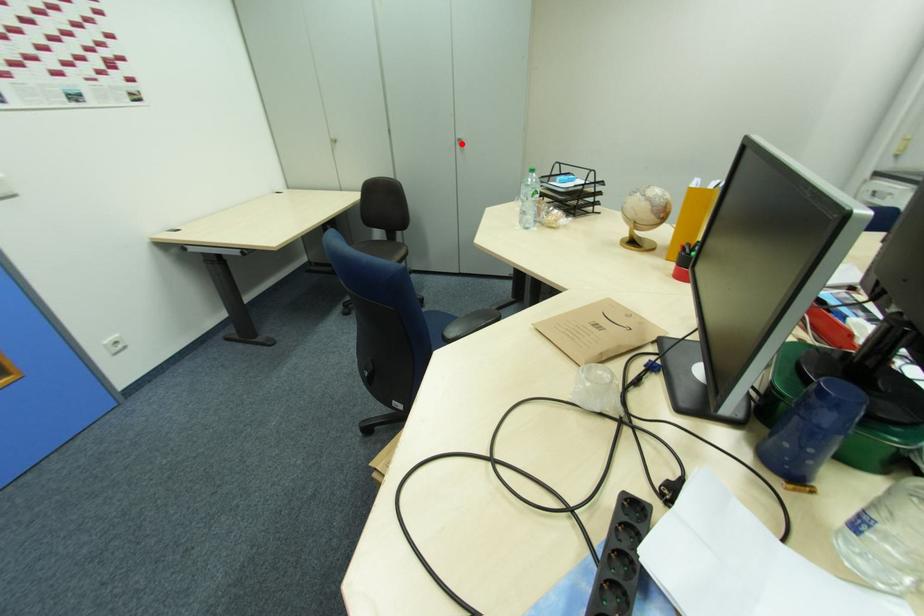
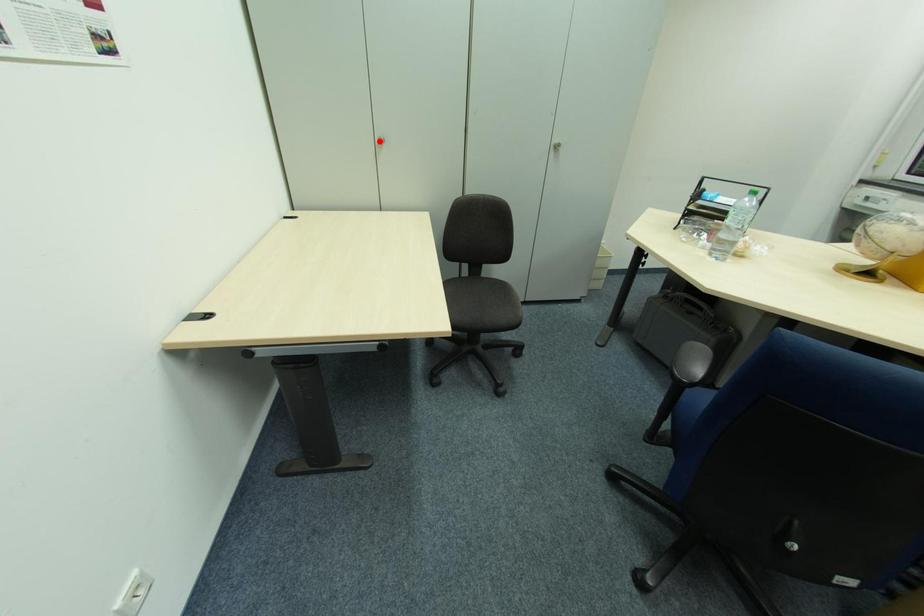
I am providing you with two images of the same scene from different viewpoints. A red point is marked on the first image and another point is marked on the second image. Is the marked point in image1 the same physical position as the marked point in image2?

No